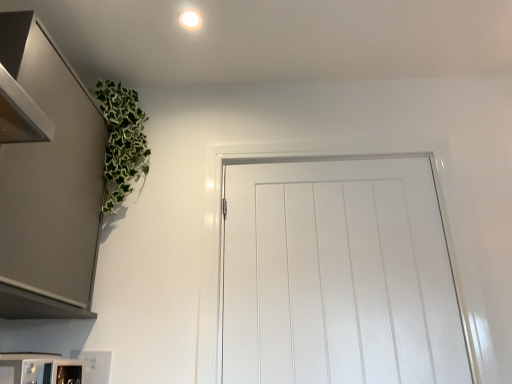
Question: Is satin metallic cabinet at upper left wider or thinner than white glossy door at center?

Choices:
 (A) thin
 (B) wide

Answer: (B)

Question: In terms of height, does satin metallic cabinet at upper left look taller or shorter compared to white glossy door at center?

Choices:
 (A) short
 (B) tall

Answer: (A)

Question: Which is farther from the satin metallic cabinet at upper left?

Choices:
 (A) white glossy microwave at lower left
 (B) white glossy door at center
 (C) white glossy light fixture at upper center

Answer: (B)

Question: Which object is the closest to the white glossy microwave at lower left?

Choices:
 (A) white glossy light fixture at upper center
 (B) satin metallic cabinet at upper left
 (C) white glossy door at center

Answer: (B)